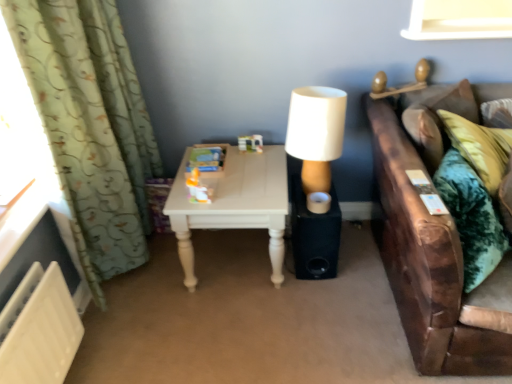
Question: Is white painted wood table at center taller than velvet green couch at right?

Choices:
 (A) yes
 (B) no

Answer: (B)

Question: Would you say white painted wood table at center contains velvet green couch at right?

Choices:
 (A) no
 (B) yes

Answer: (A)

Question: Is white painted wood table at center further to camera compared to velvet green couch at right?

Choices:
 (A) no
 (B) yes

Answer: (B)

Question: From a real-world perspective, is white painted wood table at center located beneath velvet green couch at right?

Choices:
 (A) no
 (B) yes

Answer: (B)

Question: Can you confirm if white painted wood table at center is thinner than velvet green couch at right?

Choices:
 (A) yes
 (B) no

Answer: (A)

Question: From a real-world perspective, is white painted wood table at center on velvet green couch at right?

Choices:
 (A) no
 (B) yes

Answer: (A)

Question: Is translucent plastic toy at center at the left side of black matte speaker at lower right?

Choices:
 (A) yes
 (B) no

Answer: (A)

Question: Can you confirm if translucent plastic toy at center is wider than black matte speaker at lower right?

Choices:
 (A) yes
 (B) no

Answer: (B)

Question: Does translucent plastic toy at center have a smaller size compared to black matte speaker at lower right?

Choices:
 (A) yes
 (B) no

Answer: (A)

Question: From a real-world perspective, is translucent plastic toy at center below black matte speaker at lower right?

Choices:
 (A) yes
 (B) no

Answer: (B)

Question: From a real-world perspective, is translucent plastic toy at center located higher than black matte speaker at lower right?

Choices:
 (A) yes
 (B) no

Answer: (A)

Question: Is the surface of translucent plastic toy at center in direct contact with black matte speaker at lower right?

Choices:
 (A) yes
 (B) no

Answer: (B)

Question: Is white painted wood table at center wider than black matte speaker at lower right?

Choices:
 (A) no
 (B) yes

Answer: (B)